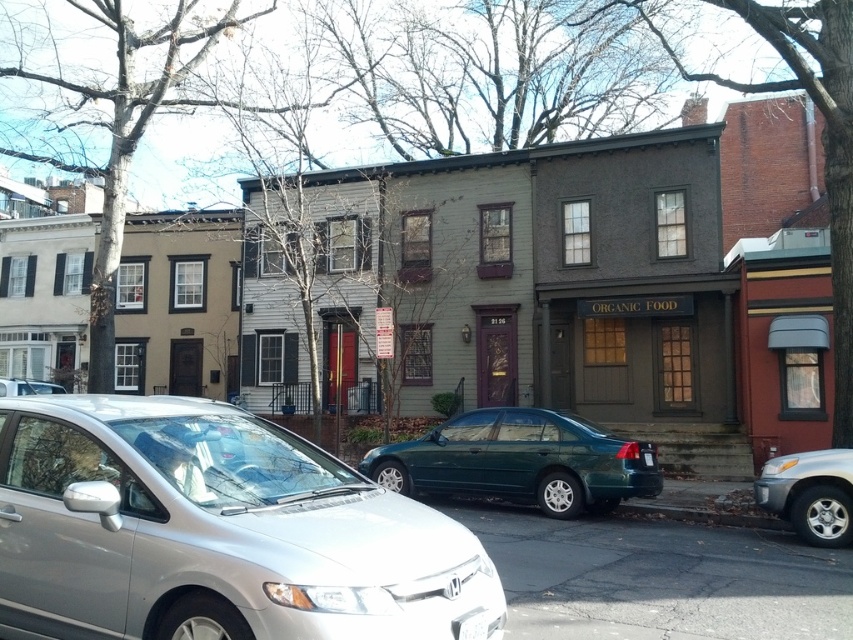
Question: Can you confirm if satin silver sedan at center is smaller than white plastic license plate at center?

Choices:
 (A) no
 (B) yes

Answer: (A)

Question: Which of the following is the farthest from the observer?

Choices:
 (A) (627, 484)
 (B) (73, 525)
 (C) (817, 477)

Answer: (A)

Question: Which object appears closest to the camera in this image?

Choices:
 (A) silver metallic suv at lower right
 (B) satin silver sedan at center
 (C) teal glossy sedan at center
 (D) white plastic license plate at center

Answer: (B)

Question: Does teal glossy sedan at center appear on the right side of white plastic license plate at center?

Choices:
 (A) yes
 (B) no

Answer: (B)

Question: Does teal glossy sedan at center have a greater width compared to silver metallic suv at lower right?

Choices:
 (A) yes
 (B) no

Answer: (A)

Question: Based on their relative distances, which object is farther from the silver metallic suv at lower right?

Choices:
 (A) white plastic license plate at center
 (B) teal glossy sedan at center
 (C) satin silver sedan at center

Answer: (C)